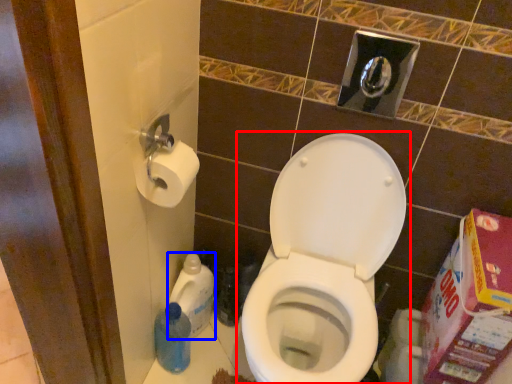
Question: Which of the following is the closest to the observer, toilet (highlighted by a red box) or cleaning product (highlighted by a blue box)?

Choices:
 (A) toilet
 (B) cleaning product

Answer: (A)